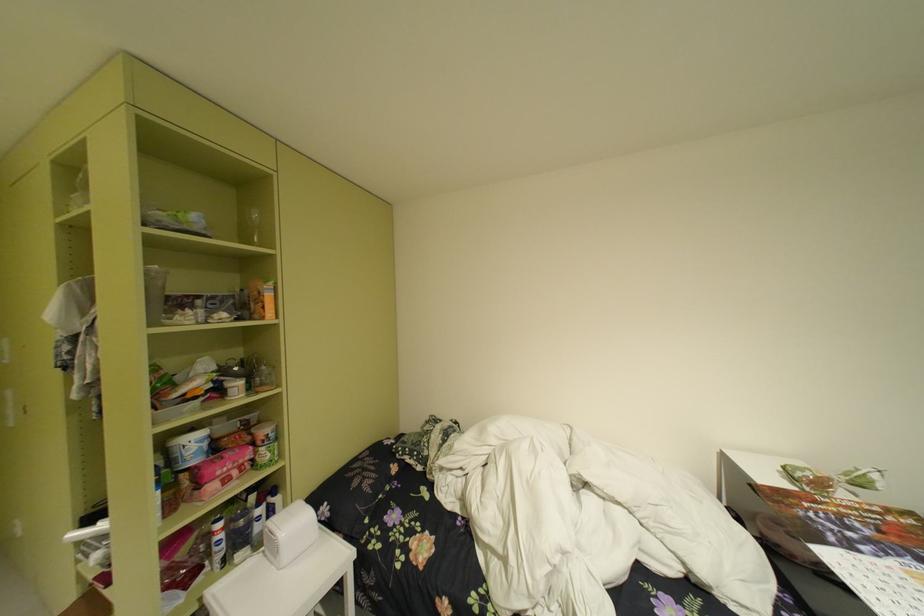
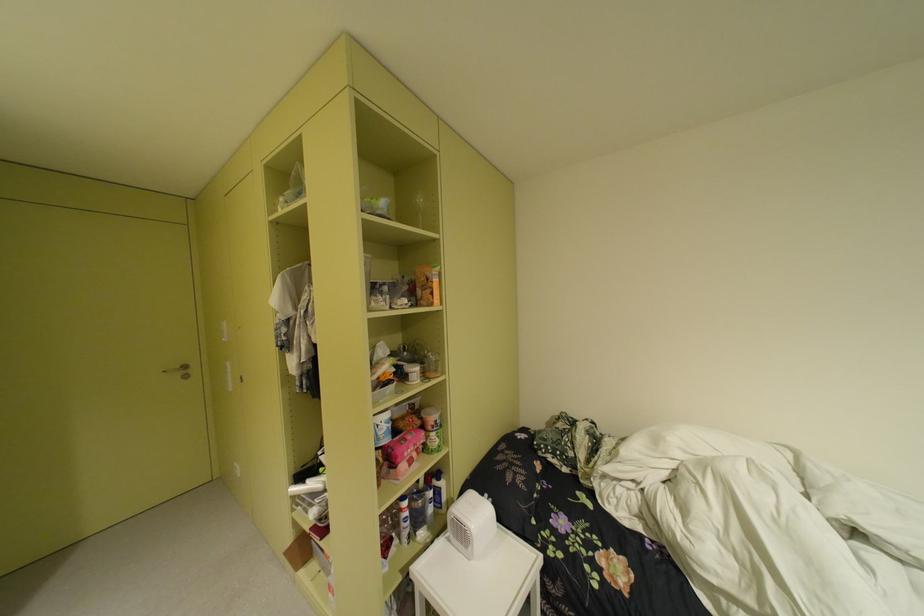
Question: The images are taken continuously from a first-person perspective. In which direction are you moving?

Choices:
 (A) Left
 (B) Right
 (C) Forward
 (D) Backward

Answer: (A)